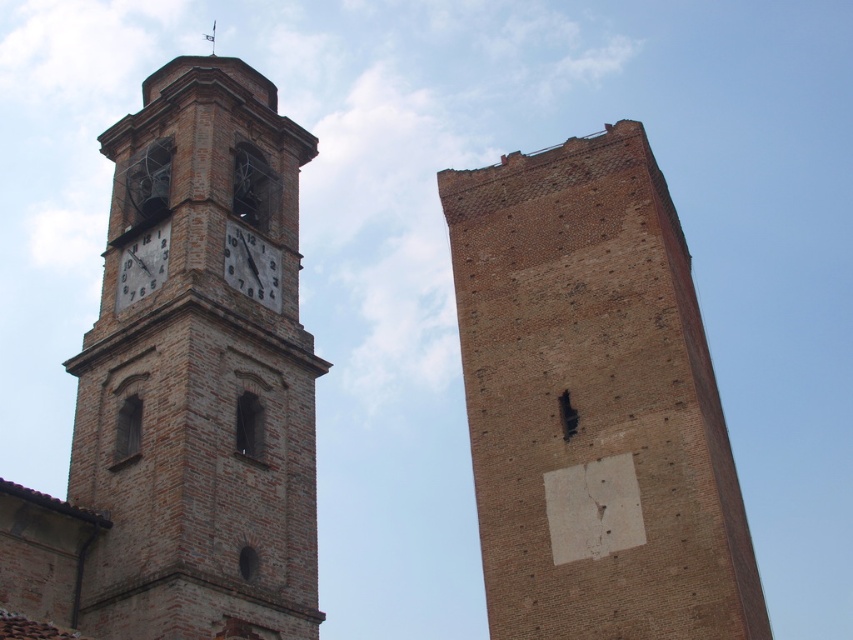
Question: Which object appears closest to the camera in this image?

Choices:
 (A) brown brick clock tower at left
 (B) brown brick tower at center
 (C) matte brick clock at upper left

Answer: (A)

Question: Which point is closer to the camera?

Choices:
 (A) matte brick clock at upper left
 (B) brown brick tower at center

Answer: (B)

Question: Which is farther from the brown brick tower at center?

Choices:
 (A) matte brick clock at upper left
 (B) brown brick clock tower at left
 (C) matte brick clock at center

Answer: (A)

Question: Does brown brick tower at center appear on the right side of brown brick clock tower at left?

Choices:
 (A) no
 (B) yes

Answer: (B)

Question: Can you confirm if brown brick tower at center is thinner than brown brick clock tower at left?

Choices:
 (A) no
 (B) yes

Answer: (B)

Question: Does brown brick tower at center have a larger size compared to matte brick clock at upper left?

Choices:
 (A) no
 (B) yes

Answer: (B)